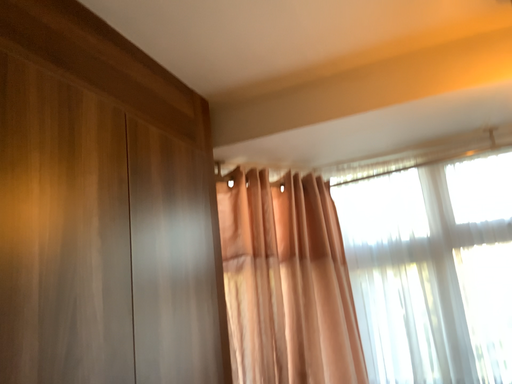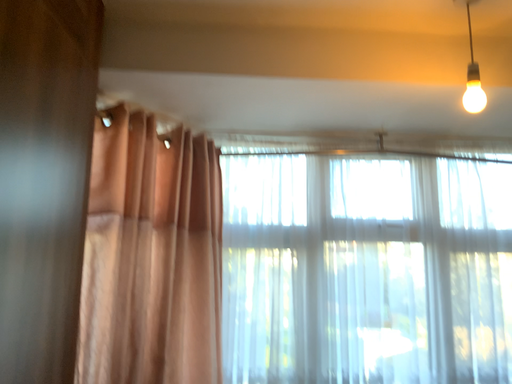
Question: How did the camera likely rotate when shooting the video?

Choices:
 (A) rotated right
 (B) rotated left

Answer: (A)